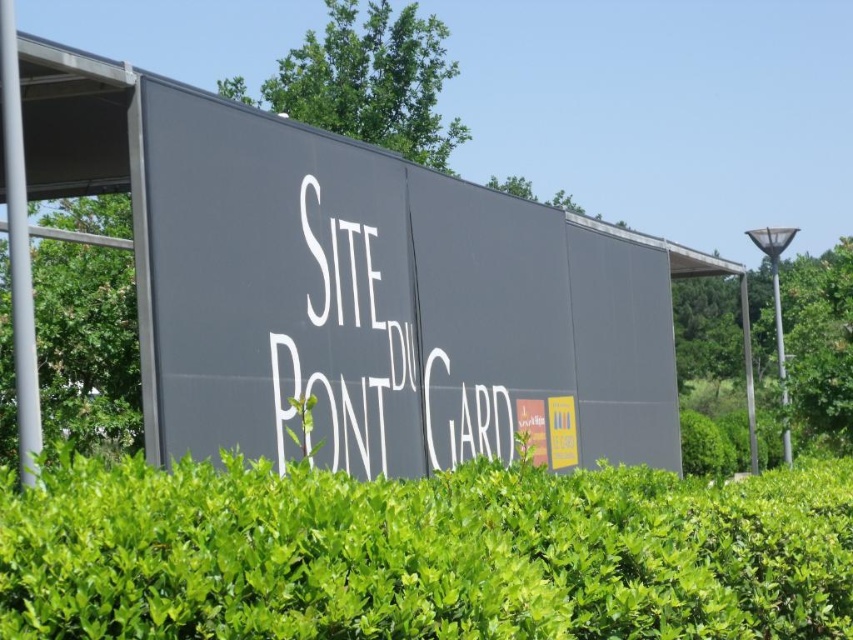
You are a landscape architect designing a pathway that needs to pass between the matte gray sign at center and the green leafy hedge at center. Considering their heights, which one should you place closer to the ground to ensure pedestrians can easily see both the sign and the hedge?

The green leafy hedge at center should be placed closer to the ground because the matte gray sign at center is much taller. This way, pedestrians can easily see both the sign above and the hedge below without obstruction.

You are a landscape designer planning to place a new decorative element between the matte gray sign at center and the green leafy bush at left. Considering their sizes, which object should you place closer to the smaller one to maintain balance?

The matte gray sign at center is smaller in width than the green leafy bush at left. To maintain balance, place the new decorative element closer to the matte gray sign at center since it is smaller.

You are a visitor at the Pont du Gard site and want to take a photo of the matte gray sign at center and the green leafy hedge at center. Since you want both objects in focus, which one should you focus on first to ensure proper depth of field?

The matte gray sign at center is located above the green leafy hedge at center. To ensure both are in focus, focus on the matte gray sign at center first since it is farther away.